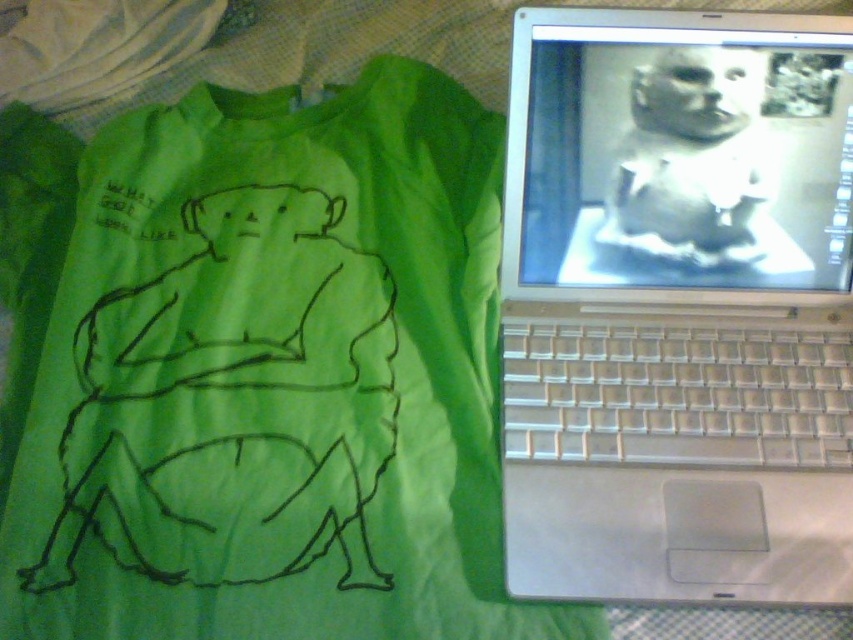
You are an interior designer planning a nursery. You have a silver metallic laptop at upper right and a white matte baby at upper right in the room. Which object is closer to the left wall?

The silver metallic laptop at upper right is closer to the left wall because it is positioned to the left of the white matte baby at upper right.